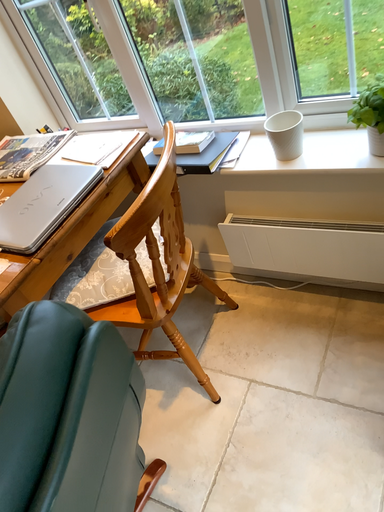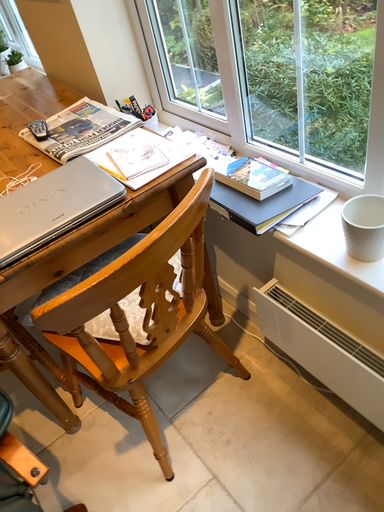
Question: How did the camera likely rotate when shooting the video?

Choices:
 (A) rotated left
 (B) rotated right

Answer: (A)